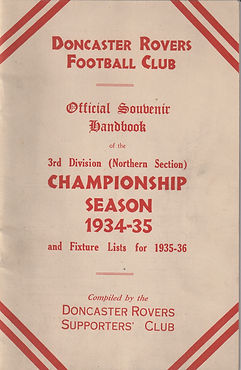
Locate an element on the screen. The width and height of the screenshot is (241, 370). cover is located at coordinates (190, 159).